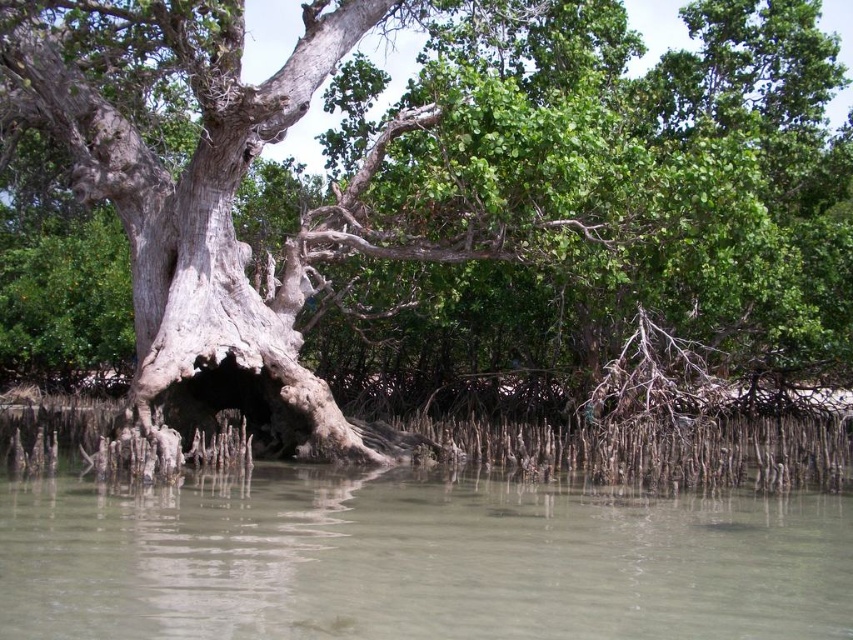
Question: Does grayish-brown bark tree at center have a greater width compared to clear sediment river at lower center?

Choices:
 (A) yes
 (B) no

Answer: (A)

Question: Which point is closer to the camera?

Choices:
 (A) (503, 88)
 (B) (326, 560)

Answer: (B)

Question: Does grayish-brown bark tree at center have a larger size compared to clear sediment river at lower center?

Choices:
 (A) yes
 (B) no

Answer: (A)

Question: Is grayish-brown bark tree at center behind clear sediment river at lower center?

Choices:
 (A) yes
 (B) no

Answer: (A)

Question: Which point appears farthest from the camera in this image?

Choices:
 (A) (111, 168)
 (B) (782, 508)

Answer: (A)

Question: Which point is farther from the camera taking this photo?

Choices:
 (A) (625, 502)
 (B) (788, 38)

Answer: (B)